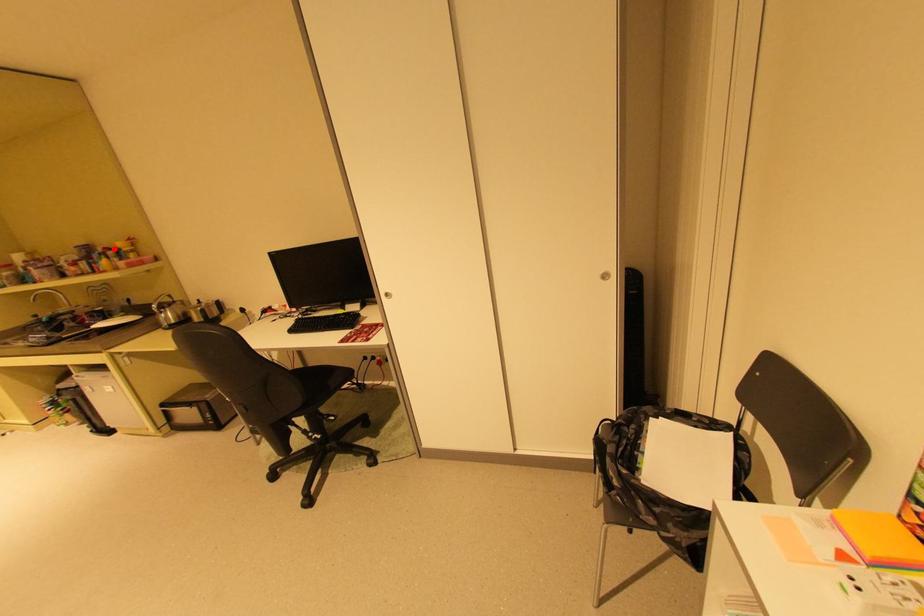
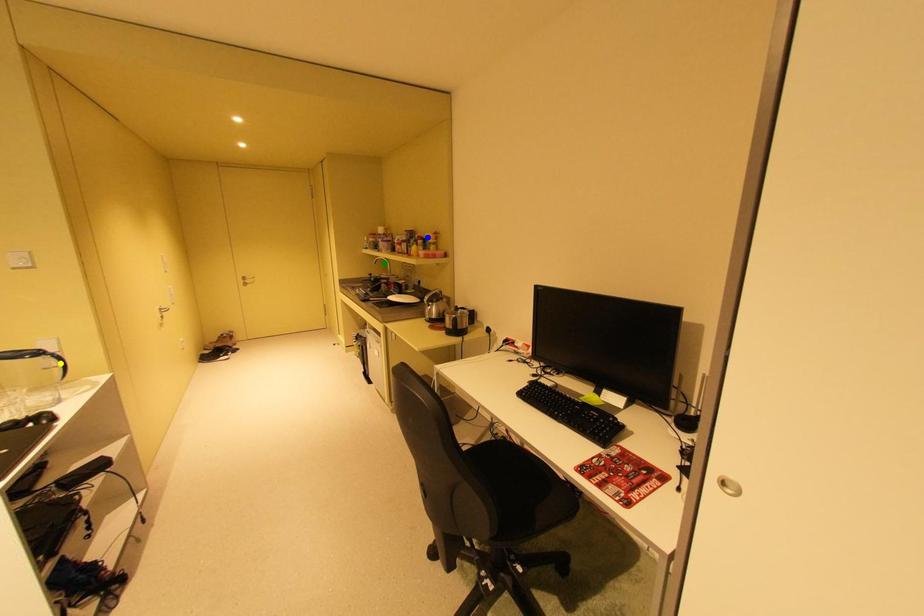
Question: I am providing you with two images of the same scene from different viewpoints. A red point is marked on the first image. You are given multiple points on the second image. In image 2, which mark is for the same physical point as the one in image 1?

Choices:
 (A) blue point
 (B) yellow point
 (C) green point

Answer: (A)